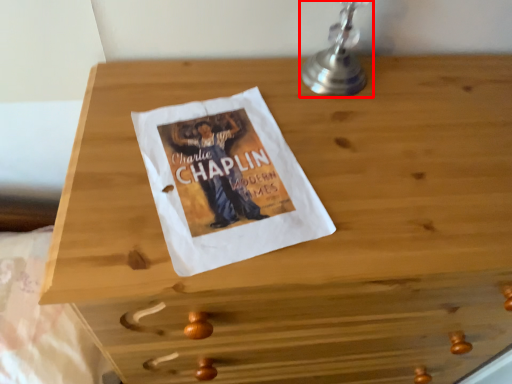
Question: From the image, what is the correct spatial relationship of table lamp (annotated by the red box) in relation to sheet?

Choices:
 (A) right
 (B) left

Answer: (A)